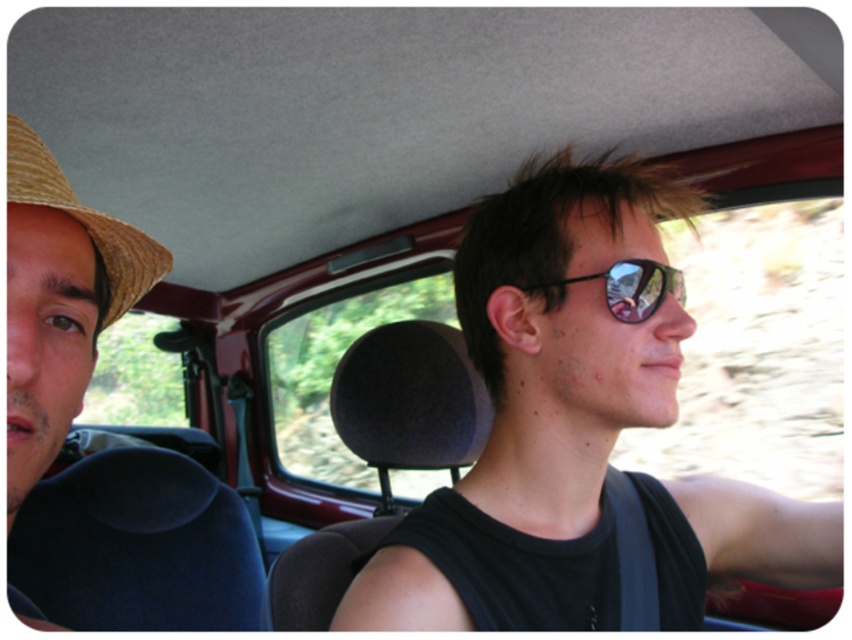
You are a passenger in a car and want to know if the straw hat at left is positioned above or below the black reflective sunglasses at center. Based on the scene, what is the correct answer?

The straw hat at left is below the black reflective sunglasses at center according to the description.

You are sitting in the passenger seat of a car and notice a straw hat at left. If you want to place it on the dashboard directly in front of you, which is located at point 0.5, 0.5, will the hat fit without overlapping the driver?

The straw hat at left is at point (58, 301), which is closer to the left side of the car. The dashboard at (426, 320) is centrally located. Moving the hat there would place it near the center, away from the driver, so it should fit without overlapping.

You are a passenger in a car and want to place both the straw hat at left and the braided straw cowboy hat at upper left on the car seat next to you. Which hat should you place first to ensure both fit comfortably?

The straw hat at left is bigger than the braided straw cowboy hat at upper left, so you should place the straw hat at left first to accommodate its larger size before placing the smaller braided straw cowboy hat at upper left.